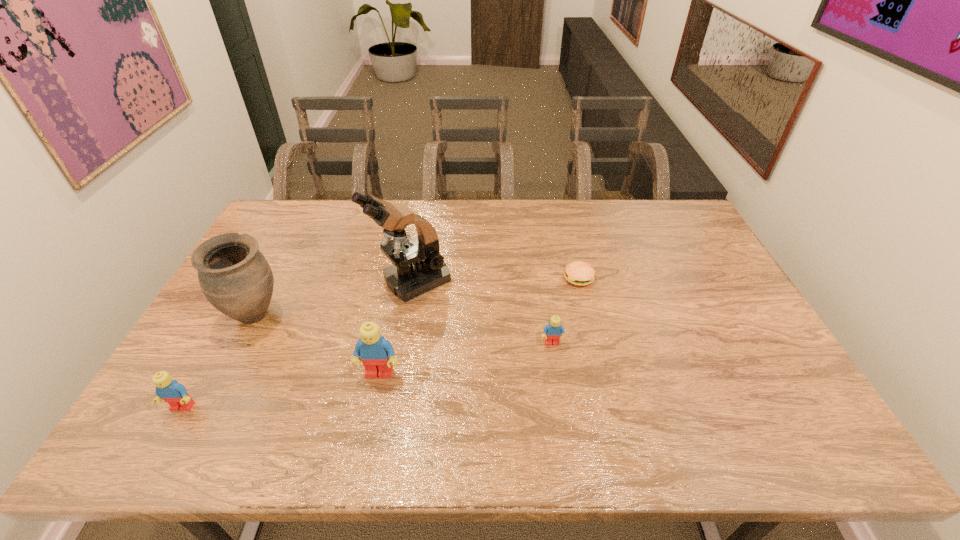
You are a GUI agent. You are given a task and a screenshot of the screen. Output one action in this format:
    pyautogui.click(x=<x>, y=<y>)
    Task: Click on the blank space at the right edge of the desktop
    This screenshot has height=540, width=960.
    Given the screenshot: What is the action you would take?
    pyautogui.click(x=755, y=345)

Image resolution: width=960 pixels, height=540 pixels. I want to click on blank space at the far left corner of the desktop, so click(296, 209).

I want to click on free point between the second tallest object and the second object from right to left, so click(403, 329).

Identify the location of empty location between the microscope and the fifth shortest object. (333, 298).

I want to click on free space between the tallest object and the nearest object, so click(x=298, y=344).

Locate an element on the screen. The image size is (960, 540). free space between the second nearest object and the microscope is located at coordinates (396, 327).

At what (x,y) coordinates should I click in order to perform the action: click on unoccupied area between the urn and the third tallest object. Please return your answer as a coordinate pair (x, y). Looking at the image, I should click on (317, 345).

You are a GUI agent. You are given a task and a screenshot of the screen. Output one action in this format:
    pyautogui.click(x=<x>, y=<y>)
    Task: Click on the unoccupied area between the tallest object and the second tallest object
    
    Given the screenshot: What is the action you would take?
    pyautogui.click(x=333, y=298)

Find the location of a particular element. object that stands as the fourth closest to the tallest object is located at coordinates (580, 273).

Locate an element on the screen. This screenshot has height=540, width=960. the fourth closest object to the nearest object is located at coordinates (552, 332).